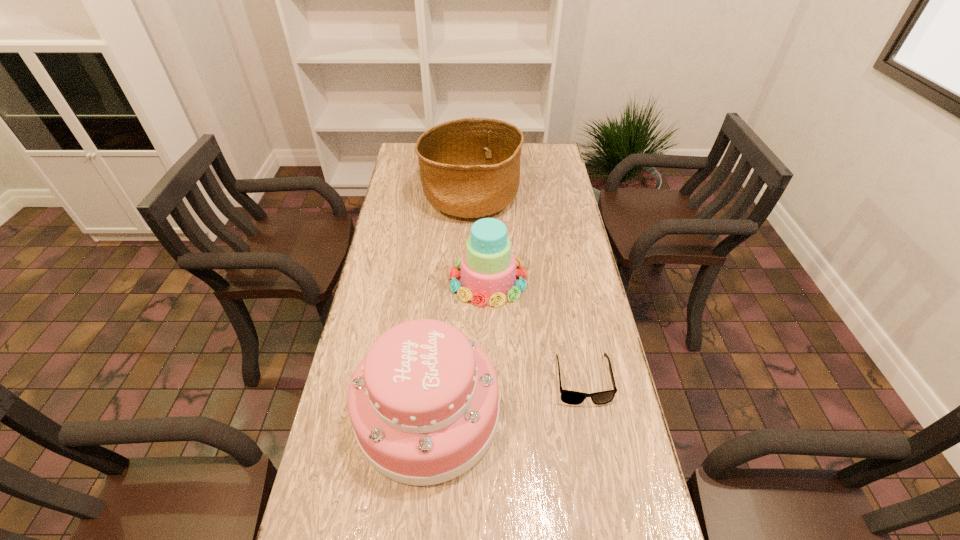
Locate an element on the screen. vacant area that lies between the sunglasses and the farther cake is located at coordinates (536, 330).

The image size is (960, 540). I want to click on unoccupied position between the nearer cake and the farthest object, so click(449, 305).

At what (x,y) coordinates should I click in order to perform the action: click on object that ranks as the second closest to the farther cake. Please return your answer as a coordinate pair (x, y). The image size is (960, 540). Looking at the image, I should click on (424, 402).

You are a GUI agent. You are given a task and a screenshot of the screen. Output one action in this format:
    pyautogui.click(x=<x>, y=<y>)
    Task: Click on the object that stands as the closest to the basket
    
    Given the screenshot: What is the action you would take?
    pyautogui.click(x=488, y=266)

The image size is (960, 540). I want to click on free space that satisfies the following two spatial constraints: 1. on the front side of the farther cake; 2. on the right side of the farthest object, so click(468, 280).

Where is `vacant space that satisfies the following two spatial constraints: 1. on the front side of the basket; 2. on the right side of the farther cake`? Image resolution: width=960 pixels, height=540 pixels. vacant space that satisfies the following two spatial constraints: 1. on the front side of the basket; 2. on the right side of the farther cake is located at coordinates (468, 280).

You are a GUI agent. You are given a task and a screenshot of the screen. Output one action in this format:
    pyautogui.click(x=<x>, y=<y>)
    Task: Click on the blank space that satisfies the following two spatial constraints: 1. on the front side of the third nearest object; 2. on the right side of the basket
    
    Given the screenshot: What is the action you would take?
    pyautogui.click(x=468, y=280)

Image resolution: width=960 pixels, height=540 pixels. I want to click on free spot that satisfies the following two spatial constraints: 1. on the back side of the farther cake; 2. on the right side of the nearer cake, so click(x=440, y=280).